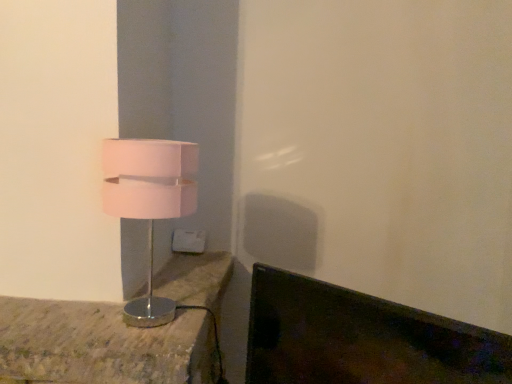
You are a GUI agent. You are given a task and a screenshot of the screen. Output one action in this format:
    pyautogui.click(x=<x>, y=<y>)
    Task: Click on the vacant area located to the right-hand side of white plastic electric outlet at center
    The width and height of the screenshot is (512, 384).
    Given the screenshot: What is the action you would take?
    pyautogui.click(x=217, y=257)